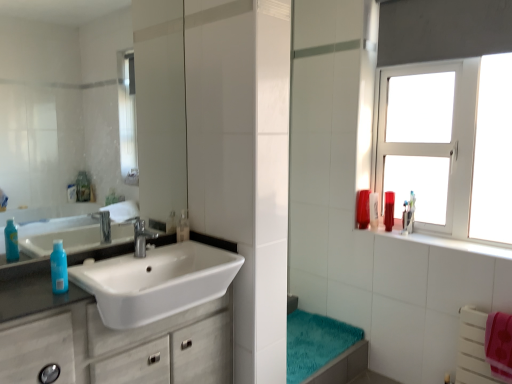
In order to face white plastic window at upper right, should I rotate leftwards or rightwards?

To align with it, rotate right about 23.546°.

Describe the element at coordinates (362, 209) in the screenshot. I see `translucent plastic mouthwash at upper right, the 2th mouthwash from the left` at that location.

Where is `translucent plastic bottle at left`? The width and height of the screenshot is (512, 384). translucent plastic bottle at left is located at coordinates (59, 268).

The width and height of the screenshot is (512, 384). Describe the element at coordinates (59, 268) in the screenshot. I see `translucent plastic bottle at left` at that location.

This screenshot has width=512, height=384. What do you see at coordinates (60, 111) in the screenshot?
I see `clear glass mirror at upper left` at bounding box center [60, 111].

Image resolution: width=512 pixels, height=384 pixels. In order to click on silver metallic faucet at center in this screenshot , I will do `click(141, 237)`.

Locate an element on the screen. This screenshot has width=512, height=384. translucent plastic mouthwash at sink, the 1th mouthwash viewed from the left is located at coordinates (183, 227).

This screenshot has height=384, width=512. Identify the location of white plastic window at upper right. pos(448,144).

In the image, is translucent plastic bottle at left on the left side or the right side of clear glass mirror at upper left?

translucent plastic bottle at left is to the left of clear glass mirror at upper left.

Considering the sizes of translucent plastic bottle at left and clear glass mirror at upper left in the image, is translucent plastic bottle at left bigger or smaller than clear glass mirror at upper left?

Clearly, translucent plastic bottle at left is smaller in size than clear glass mirror at upper left.

Is translucent plastic bottle at left positioned beyond the bounds of clear glass mirror at upper left?

Yes, translucent plastic bottle at left is not within clear glass mirror at upper left.

From the image's perspective, is translucent plastic bottle at left on clear glass mirror at upper left?

No, from the image's perspective, translucent plastic bottle at left is not on top of clear glass mirror at upper left.

Who is shorter, clear glass mirror at upper left or white plastic window at upper right?

clear glass mirror at upper left.

Considering the relative sizes of clear glass mirror at upper left and white plastic window at upper right in the image provided, is clear glass mirror at upper left bigger than white plastic window at upper right?

No, clear glass mirror at upper left is not bigger than white plastic window at upper right.

From a real-world perspective, which object rests below the other?

clear glass mirror at upper left, from a real-world perspective.

Is translucent plastic mouthwash at upper right, the third mouthwash positioned from the right, far away from translucent plastic bottle at left?

Yes, translucent plastic mouthwash at upper right, the third mouthwash positioned from the right, and translucent plastic bottle at left are located far from each other.

Between translucent plastic mouthwash at upper right, which appears as the first mouthwash when viewed from the back, and translucent plastic bottle at left, which one has larger width?

With larger width is translucent plastic bottle at left.

In the image, is translucent plastic mouthwash at upper right, the 2th mouthwash from the left, on the left side or the right side of translucent plastic bottle at left?

translucent plastic mouthwash at upper right, the 2th mouthwash from the left, is positioned on translucent plastic bottle at left's right side.

From a real-world perspective, which is physically above, translucent plastic mouthwash at upper right, which appears as the first mouthwash when viewed from the back, or translucent plastic bottle at left?

From a 3D spatial view, translucent plastic bottle at left is above.

Does silver metallic faucet at center have a smaller size compared to white plastic window at upper right?

Indeed, silver metallic faucet at center has a smaller size compared to white plastic window at upper right.

Do you think silver metallic faucet at center is within white plastic window at upper right, or outside of it?

silver metallic faucet at center lies outside white plastic window at upper right.

Identify the location of tap below the white plastic window at upper right (from a real-world perspective). This screenshot has height=384, width=512. (141, 237).

From a real-world perspective, starting from the translucent plastic mouthwash at right, the 2th mouthwash viewed from the right, which mouthwash is the 3rd one vertically above it? Please provide its 2D coordinates.

[(183, 227)]

Which is nearer, (x=183, y=215) or (x=375, y=218)?

Clearly, point (x=183, y=215) is closer to the camera than point (x=375, y=218).

Looking at this image, based on their sizes in the image, would you say translucent plastic mouthwash at sink, the 1th mouthwash viewed from the left, is bigger or smaller than translucent plastic mouthwash at right, placed as the 3th mouthwash when sorted from left to right?

Considering their sizes, translucent plastic mouthwash at sink, the 1th mouthwash viewed from the left, takes up less space than translucent plastic mouthwash at right, placed as the 3th mouthwash when sorted from left to right.

Locate an element on the screen. sink on the left of translucent plastic mouthwash at upper right, placed as the second mouthwash when sorted from front to back is located at coordinates (156, 282).

Is white glossy sink at left touching translucent plastic mouthwash at upper right, placed as the second mouthwash when sorted from front to back?

No, white glossy sink at left is not next to translucent plastic mouthwash at upper right, placed as the second mouthwash when sorted from front to back.

Can you confirm if white glossy sink at left is taller than translucent plastic mouthwash at upper right, which is counted as the 3th mouthwash, starting from the back?

No.

From a real-world perspective, is white glossy sink at left under translucent plastic mouthwash at upper right, placed as the 4th mouthwash when sorted from left to right?

Yes, from a real-world perspective, white glossy sink at left is below translucent plastic mouthwash at upper right, placed as the 4th mouthwash when sorted from left to right.

Is white matte cabinet at left outside of translucent plastic mouthwash at upper right, the third mouthwash positioned from the right?

white matte cabinet at left is positioned outside translucent plastic mouthwash at upper right, the third mouthwash positioned from the right.

Which object is closer to the camera taking this photo, white matte cabinet at left or translucent plastic mouthwash at upper right, the third mouthwash positioned from the right?

white matte cabinet at left.

From a real-world perspective, starting from the white matte cabinet at left, which mouthwash is the 3rd one vertically above it? Please provide its 2D coordinates.

[(362, 209)]

From a real-world perspective, is white matte cabinet at left physically above translucent plastic mouthwash at upper right, which appears as the first mouthwash when viewed from the back?

No, from a real-world perspective, white matte cabinet at left is not over translucent plastic mouthwash at upper right, which appears as the first mouthwash when viewed from the back

The width and height of the screenshot is (512, 384). In order to click on turquoise on the left of clear glass mirror at upper left in this screenshot , I will do `click(59, 268)`.

In the image, there is a white plastic window at upper right. At what (x,y) coordinates should I click in order to perform the action: click on mirror below it (from the image's perspective). Please return your answer as a coordinate pair (x, y). The image size is (512, 384). Looking at the image, I should click on (60, 111).

From the picture: Estimate the real-world distances between objects in this image. Which object is further from white glossy sink at left, translucent plastic bottle at left or translucent plastic mouthwash at upper right, placed as the second mouthwash when sorted from front to back?

translucent plastic mouthwash at upper right, placed as the second mouthwash when sorted from front to back, is further to white glossy sink at left.

When comparing their distances from translucent plastic mouthwash at right, the 2th mouthwash viewed from the right, does translucent plastic bottle at left or teal plush bath towel at lower center seem further?

translucent plastic bottle at left lies further to translucent plastic mouthwash at right, the 2th mouthwash viewed from the right, than the other object.

When comparing their distances from white glossy sink at left, does translucent plastic mouthwash at upper right, which is counted as the 3th mouthwash, starting from the back, or white plastic window at upper right seem closer?

white plastic window at upper right.

Which object lies nearer to the anchor point translucent plastic mouthwash at upper right, the 1th mouthwash positioned from the right, white plastic window at upper right or silver metallic faucet at center?

Among the two, white plastic window at upper right is located nearer to translucent plastic mouthwash at upper right, the 1th mouthwash positioned from the right.

Estimate the real-world distances between objects in this image. Which object is further from clear glass mirror at upper left, translucent plastic mouthwash at upper right, which appears as the first mouthwash when viewed from the back, or teal plush bath towel at lower center?

Based on the image, translucent plastic mouthwash at upper right, which appears as the first mouthwash when viewed from the back, appears to be further to clear glass mirror at upper left.

From the image, which object appears to be farther from translucent plastic mouthwash at right, acting as the 2th mouthwash starting from the back, teal plush bath towel at lower center or silver metallic faucet at center?

Among the two, silver metallic faucet at center is located further to translucent plastic mouthwash at right, acting as the 2th mouthwash starting from the back.

When comparing their distances from translucent plastic mouthwash at right, the 2th mouthwash viewed from the right, does teal plush bath towel at lower center or translucent plastic mouthwash at upper right, which is counted as the 3th mouthwash, starting from the back, seem closer?

Based on the image, translucent plastic mouthwash at upper right, which is counted as the 3th mouthwash, starting from the back, appears to be nearer to translucent plastic mouthwash at right, the 2th mouthwash viewed from the right.

Consider the image. Based on their spatial positions, is silver metallic faucet at center or clear glass mirror at upper left further from translucent plastic mouthwash at upper right, the 1th mouthwash positioned from the right?

The object further to translucent plastic mouthwash at upper right, the 1th mouthwash positioned from the right, is clear glass mirror at upper left.

Locate an element on the screen. The width and height of the screenshot is (512, 384). mouthwash between translucent plastic mouthwash at upper right, the third mouthwash positioned from the right, and translucent plastic mouthwash at upper right, the 1th mouthwash positioned from the right, from left to right is located at coordinates [x=374, y=210].

This screenshot has width=512, height=384. I want to click on bathroom cabinet between translucent plastic bottle at left and translucent plastic mouthwash at upper right, the 2th mouthwash from the left, in the horizontal direction, so click(x=106, y=341).

Where is `tap between clear glass mirror at upper left and teal plush bath towel at lower center from top to bottom`? tap between clear glass mirror at upper left and teal plush bath towel at lower center from top to bottom is located at coordinates (141, 237).

Where is `sink between translucent plastic bottle at left and teal plush bath towel at lower center`? sink between translucent plastic bottle at left and teal plush bath towel at lower center is located at coordinates (156, 282).